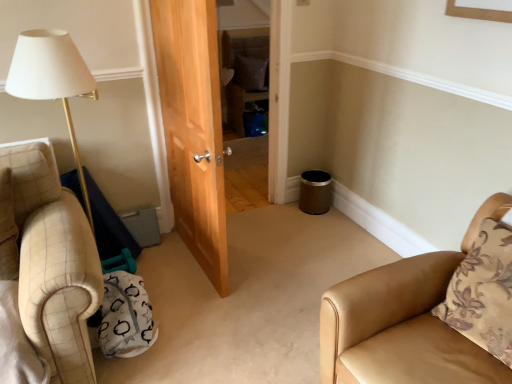
Question: Is the depth of brown floral pillow at right, which is the 1th pillow from front to back, less than that of brown fabric pillow at center, which is the second pillow from right to left?

Choices:
 (A) no
 (B) yes

Answer: (B)

Question: Does brown floral pillow at right, which is the second pillow from top to bottom, appear on the left side of brown fabric pillow at center, which appears as the 1th pillow when viewed from the left?

Choices:
 (A) no
 (B) yes

Answer: (A)

Question: From the image's perspective, is brown floral pillow at right, which is the second pillow from top to bottom, located beneath brown fabric pillow at center, acting as the second pillow starting from the bottom?

Choices:
 (A) no
 (B) yes

Answer: (B)

Question: Does brown floral pillow at right, positioned as the 1th pillow in right-to-left order, have a larger size compared to brown fabric pillow at center, which is the second pillow from right to left?

Choices:
 (A) no
 (B) yes

Answer: (B)

Question: Would you say brown floral pillow at right, the 2th pillow in the back-to-front sequence, is outside brown fabric pillow at center, the first pillow viewed from the back?

Choices:
 (A) no
 (B) yes

Answer: (B)

Question: Is brown floral pillow at right, which is the second pillow from top to bottom, oriented away from brown fabric pillow at center, which appears as the 1th pillow when viewed from the left?

Choices:
 (A) yes
 (B) no

Answer: (B)

Question: Is tan leather chair at lower right taller than brown floral pillow at right, the first pillow in the bottom-to-top sequence?

Choices:
 (A) no
 (B) yes

Answer: (B)

Question: From the image's perspective, is tan leather chair at lower right located beneath brown floral pillow at right, the first pillow in the bottom-to-top sequence?

Choices:
 (A) no
 (B) yes

Answer: (B)

Question: Considering the relative sizes of tan leather chair at lower right and brown floral pillow at right, which ranks as the second pillow in left-to-right order, in the image provided, is tan leather chair at lower right bigger than brown floral pillow at right, which ranks as the second pillow in left-to-right order,?

Choices:
 (A) yes
 (B) no

Answer: (A)

Question: Does tan leather chair at lower right have a lesser height compared to brown floral pillow at right, positioned as the 1th pillow in right-to-left order?

Choices:
 (A) yes
 (B) no

Answer: (B)

Question: Is tan leather chair at lower right not within brown floral pillow at right, the first pillow in the bottom-to-top sequence?

Choices:
 (A) no
 (B) yes

Answer: (B)

Question: Could you tell me if tan leather chair at lower right is turned towards brown floral pillow at right, positioned as the 1th pillow in right-to-left order?

Choices:
 (A) no
 (B) yes

Answer: (B)

Question: Considering the relative sizes of tan leather chair at lower right and brown fabric pillow at center, the second pillow positioned from the front, in the image provided, is tan leather chair at lower right smaller than brown fabric pillow at center, the second pillow positioned from the front,?

Choices:
 (A) yes
 (B) no

Answer: (B)